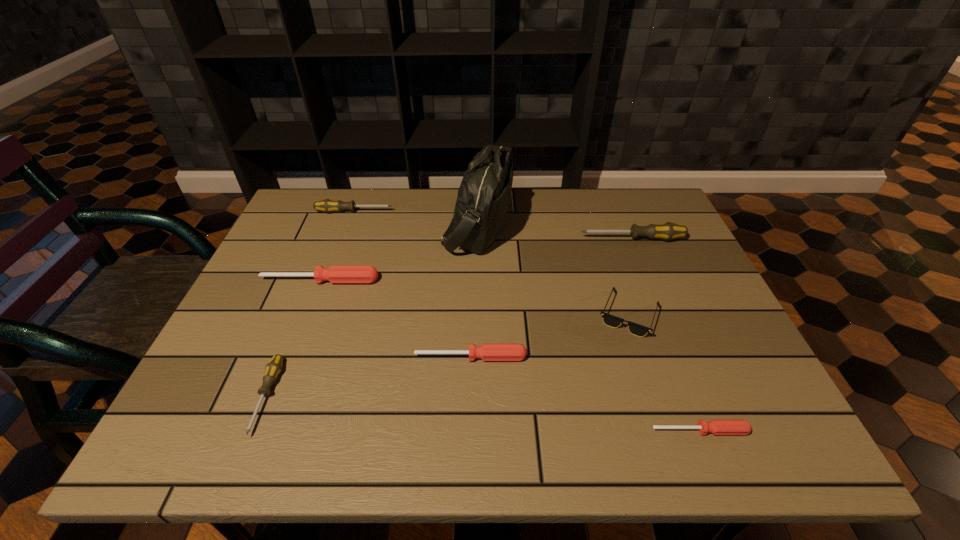
Locate an element on the screen. vacant space that satisfies the following two spatial constraints: 1. at the tip of the second farthest screwdriver; 2. at the tip of the nearest gray screwdriver is located at coordinates (696, 397).

I want to click on free space that satisfies the following two spatial constraints: 1. at the tip of the second smallest gray screwdriver; 2. at the tip of the nearest gray screwdriver, so point(287,397).

This screenshot has width=960, height=540. What are the coordinates of `free spot that satisfies the following two spatial constraints: 1. on the front side of the fourth farthest object; 2. on the left side of the second red screwdriver from left to right` in the screenshot? It's located at (291, 357).

The image size is (960, 540). I want to click on free space that satisfies the following two spatial constraints: 1. at the tip of the second tallest object; 2. at the tip of the nearest gray screwdriver, so pyautogui.click(x=696, y=397).

At what (x,y) coordinates should I click in order to perform the action: click on vacant space that satisfies the following two spatial constraints: 1. at the tip of the smallest red screwdriver; 2. on the right side of the second smallest gray screwdriver. Please return your answer as a coordinate pair (x, y). Looking at the image, I should click on (275, 430).

You are a GUI agent. You are given a task and a screenshot of the screen. Output one action in this format:
    pyautogui.click(x=<x>, y=<y>)
    Task: Click on the free region that satisfies the following two spatial constraints: 1. at the tip of the farthest gray screwdriver; 2. on the right side of the second biggest red screwdriver
    
    Given the screenshot: What is the action you would take?
    pyautogui.click(x=301, y=357)

You are a GUI agent. You are given a task and a screenshot of the screen. Output one action in this format:
    pyautogui.click(x=<x>, y=<y>)
    Task: Click on the free spot that satisfies the following two spatial constraints: 1. at the tip of the tallest screwdriver; 2. on the front side of the farthest red screwdriver
    The height and width of the screenshot is (540, 960).
    Given the screenshot: What is the action you would take?
    pyautogui.click(x=649, y=280)